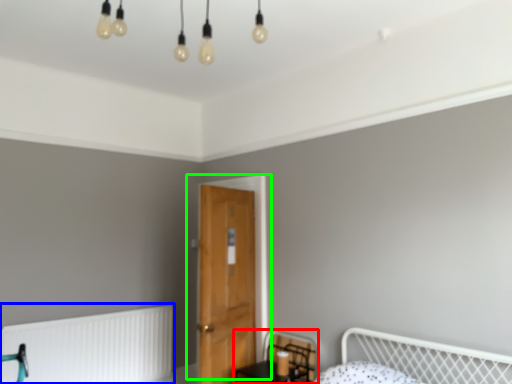
Question: Considering the real-world distances, which object is closest to swivel chair (highlighted by a red box)? radiator (highlighted by a blue box) or door (highlighted by a green box).

Choices:
 (A) radiator
 (B) door

Answer: (B)